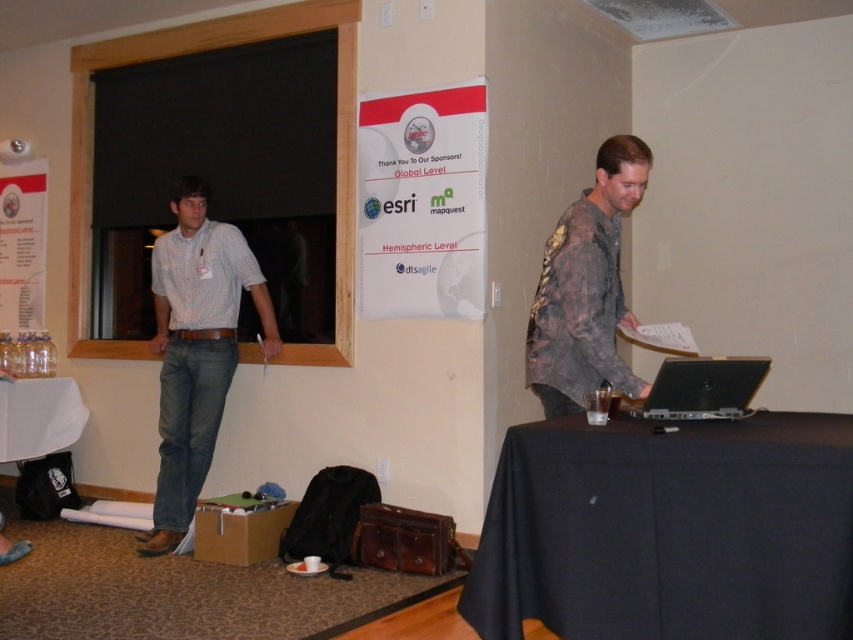
You are standing in the conference room and need to reach the silver metallic laptop at center without passing in front of the checkered shirt at left. Is this possible?

The checkered shirt at left is closer to you than the silver metallic laptop at center, so you can walk around the sides or behind the checkered shirt at left to reach the laptop without passing in front of them.

You are organizing a small meeting and need to place a 1.5 meter long laptop stand on the black fabric table at lower right or the wooden frame window at left. Based on their widths, which surface can accommodate the laptop stand without overhanging?

The wooden frame window at left has a greater width than the black fabric table at lower right, so the laptop stand should be placed on the wooden frame window at left to avoid overhanging.

You are a person who needs to place a 2.0 meter long banner on the floor between the black fabric table at lower right and the camera. Can you fit the banner without folding it?

The distance between the black fabric table at lower right and the camera is 1.95 meters, which is slightly shorter than the 2.0 meter long banner. Therefore, the banner cannot be placed without folding.